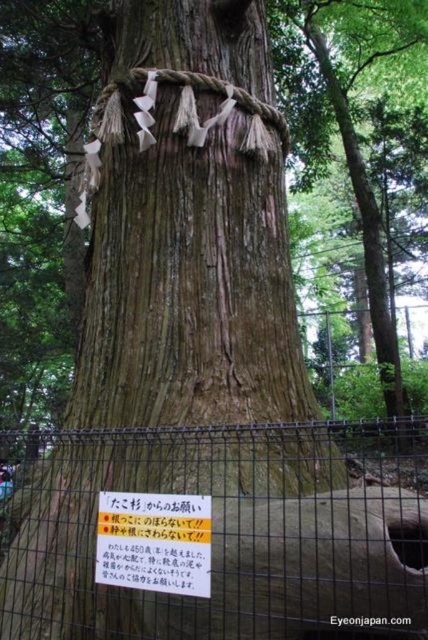
Question: Is metal wire fence at lower center positioned behind yellow paper sign at center?

Choices:
 (A) no
 (B) yes

Answer: (A)

Question: Among these points, which one is nearest to the camera?

Choices:
 (A) (214, 440)
 (B) (146, 547)

Answer: (B)

Question: Does metal wire fence at lower center have a lesser width compared to yellow paper sign at center?

Choices:
 (A) no
 (B) yes

Answer: (A)

Question: Is metal wire fence at lower center above yellow paper sign at center?

Choices:
 (A) no
 (B) yes

Answer: (A)